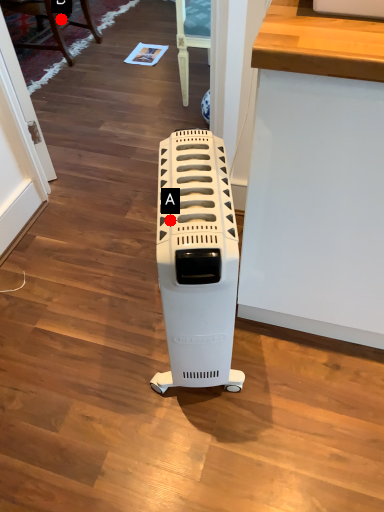
Question: Two points are circled on the image, labeled by A and B beside each circle. Which point is farther to the camera?

Choices:
 (A) A is further
 (B) B is further

Answer: (B)